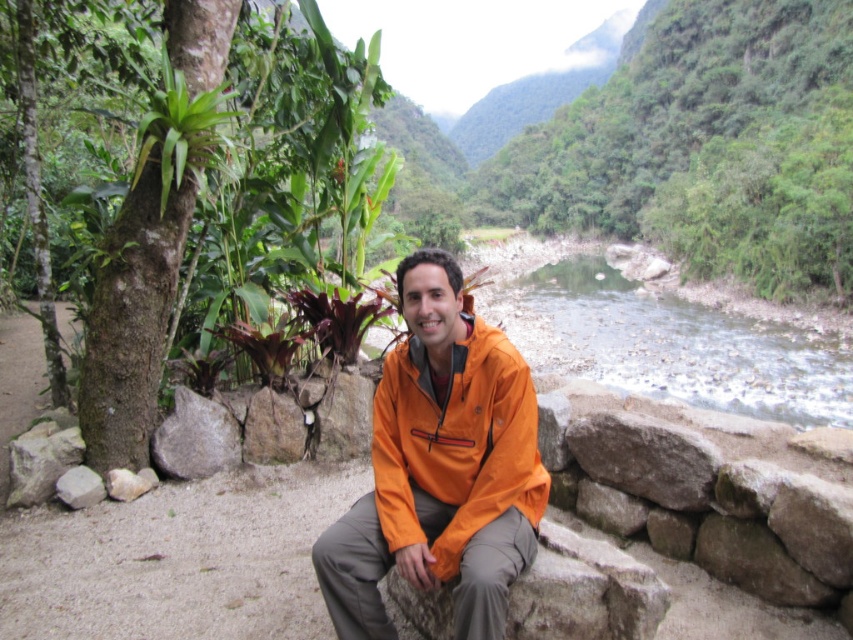
Is the position of orange waterproof jacket at center less distant than that of clear water at river right?

Yes.

Does orange waterproof jacket at center have a smaller size compared to clear water at river right?

Correct, orange waterproof jacket at center occupies less space than clear water at river right.

Who is more distant from viewer, (451, 547) or (526, 358)?

The point (526, 358) is behind.

Find the location of a particular element. The width and height of the screenshot is (853, 640). orange waterproof jacket at center is located at coordinates (440, 467).